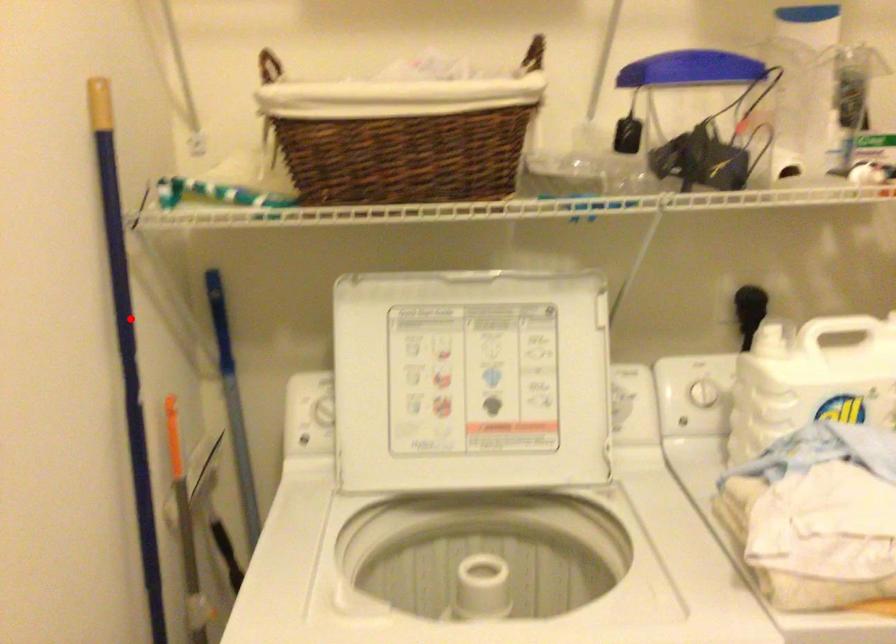
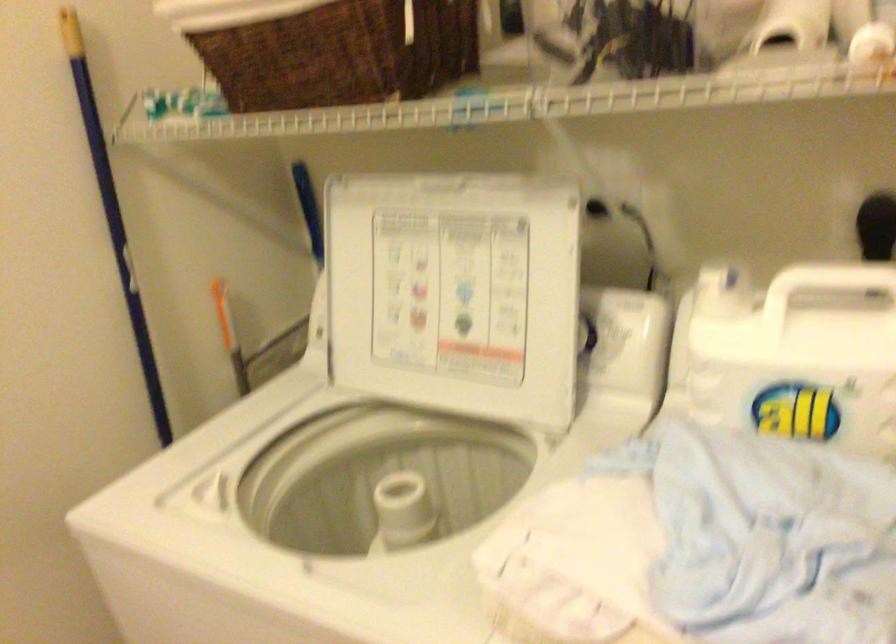
Locate, in the second image, the point that corresponds to the highlighted location in the first image.

(113, 216)